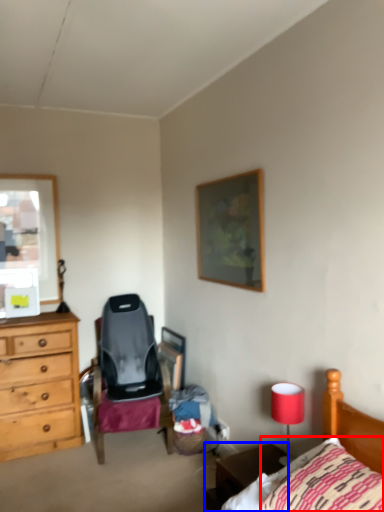
Question: Which point is further to the camera, pillow (highlighted by a red box) or nightstand (highlighted by a blue box)?

Choices:
 (A) pillow
 (B) nightstand

Answer: (B)